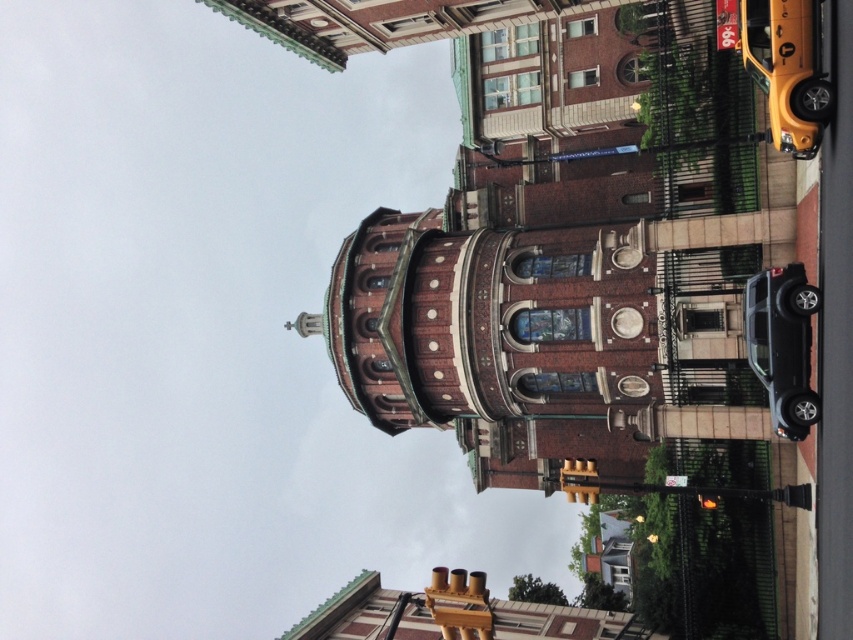
You are a pedestrian standing at the street sign in front of the church. You need to cross the street to reach the black metal fence. Which vehicle, the yellow rubber taxi at upper right or the shiny black suv at lower right, is nearer to you as you prepare to cross?

The yellow rubber taxi at upper right is closer to the viewer than the shiny black suv at lower right, so the yellow rubber taxi at upper right is nearer to you as you prepare to cross.

In the scene shown: You are standing at the point marked as point (787, 68) in the image. What object is located at this point?

The yellow rubber taxi at upper right is located at point (787, 68).

From the picture: You are a photographer trying to capture the church with both the yellow rubber taxi at upper right and the shiny black suv at lower right in the frame. Which vehicle will appear closer to the camera in your photo?

The yellow rubber taxi at upper right appears closer to the camera because it has a larger size compared to the shiny black suv at lower right.